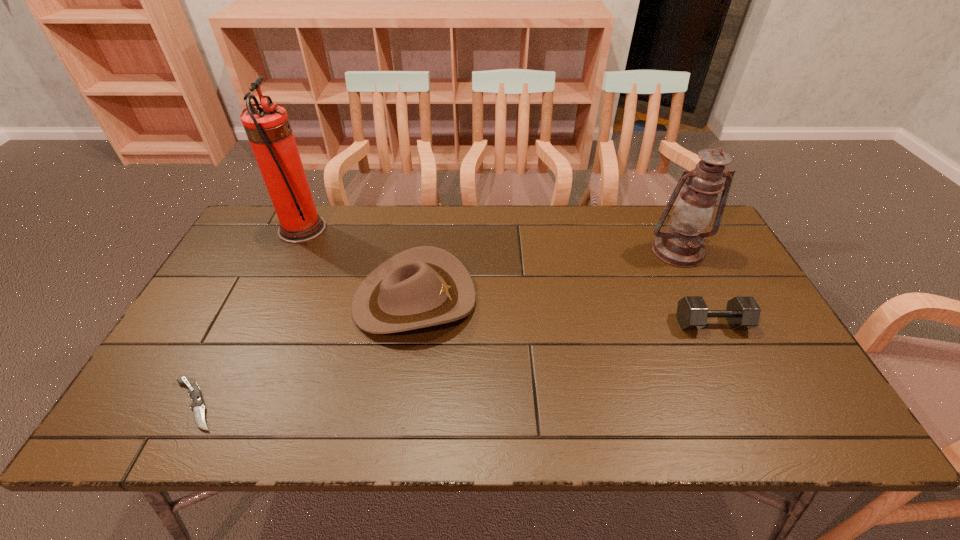
You are a GUI agent. You are given a task and a screenshot of the screen. Output one action in this format:
    pyautogui.click(x=<x>, y=<y>)
    Task: Click on the object that is the second closest to the third shortest object
    
    Given the screenshot: What is the action you would take?
    pyautogui.click(x=197, y=405)

Identify the location of the second closest object to the cowboy hat. (197, 405).

This screenshot has width=960, height=540. Find the location of `vacant space that satisfies the following two spatial constraints: 1. at the discharge end of the fire extinguisher; 2. on the left side of the dumbbell`. vacant space that satisfies the following two spatial constraints: 1. at the discharge end of the fire extinguisher; 2. on the left side of the dumbbell is located at coordinates (258, 323).

Locate an element on the screen. The image size is (960, 540). blank area in the image that satisfies the following two spatial constraints: 1. at the discharge end of the second shortest object; 2. on the right side of the tallest object is located at coordinates (258, 323).

Image resolution: width=960 pixels, height=540 pixels. I want to click on free location that satisfies the following two spatial constraints: 1. at the discharge end of the tallest object; 2. on the right side of the fourth tallest object, so click(258, 323).

This screenshot has width=960, height=540. I want to click on free spot that satisfies the following two spatial constraints: 1. at the discharge end of the tallest object; 2. on the right side of the oil lamp, so click(x=292, y=251).

At what (x,y) coordinates should I click in order to perform the action: click on vacant space that satisfies the following two spatial constraints: 1. on the back side of the pocketknife; 2. on the left side of the oil lamp. Please return your answer as a coordinate pair (x, y). The height and width of the screenshot is (540, 960). Looking at the image, I should click on (274, 251).

At what (x,y) coordinates should I click in order to perform the action: click on vacant position in the image that satisfies the following two spatial constraints: 1. on the back side of the second shortest object; 2. at the discharge end of the tallest object. Please return your answer as a coordinate pair (x, y). This screenshot has width=960, height=540. Looking at the image, I should click on (665, 229).

Where is `blank area in the image that satisfies the following two spatial constraints: 1. on the front side of the fourth shortest object; 2. with a star on the front of the cowboy hat`? blank area in the image that satisfies the following two spatial constraints: 1. on the front side of the fourth shortest object; 2. with a star on the front of the cowboy hat is located at coordinates (702, 300).

You are a GUI agent. You are given a task and a screenshot of the screen. Output one action in this format:
    pyautogui.click(x=<x>, y=<y>)
    Task: Click on the free spot that satisfies the following two spatial constraints: 1. on the back side of the second shortest object; 2. on the right side of the nearest object
    The width and height of the screenshot is (960, 540).
    Given the screenshot: What is the action you would take?
    pyautogui.click(x=236, y=323)